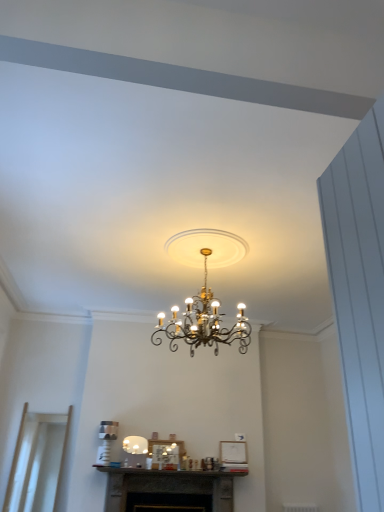
Question: Does white glossy lampshade at center, which is the 2th lamp in right-to-left order, have a greater height compared to transparent glass door at lower left?

Choices:
 (A) yes
 (B) no

Answer: (B)

Question: Is transparent glass door at lower left at the back of white glossy lampshade at center, positioned as the 1th lamp in left-to-right order?

Choices:
 (A) no
 (B) yes

Answer: (A)

Question: From the image's perspective, is white glossy lampshade at center, which ranks as the 2th lamp in top-to-bottom order, located above transparent glass door at lower left?

Choices:
 (A) no
 (B) yes

Answer: (B)

Question: Could you tell me if white glossy lampshade at center, placed as the first lamp when sorted from bottom to top, is facing transparent glass door at lower left?

Choices:
 (A) no
 (B) yes

Answer: (A)

Question: From the image's perspective, does white glossy lampshade at center, which is the 2th lamp from front to back, appear lower than transparent glass door at lower left?

Choices:
 (A) no
 (B) yes

Answer: (A)

Question: Relative to transparent glass door at lower left, is dark gray stone fireplace at center in front or behind?

Choices:
 (A) behind
 (B) front

Answer: (B)

Question: From the image's perspective, is dark gray stone fireplace at center above or below transparent glass door at lower left?

Choices:
 (A) below
 (B) above

Answer: (A)

Question: From a real-world perspective, is dark gray stone fireplace at center physically located above or below transparent glass door at lower left?

Choices:
 (A) above
 (B) below

Answer: (B)

Question: Is point (177, 476) closer or farther from the camera than point (33, 484)?

Choices:
 (A) closer
 (B) farther

Answer: (B)

Question: Relative to gold metallic chandelier at center, positioned as the second lamp in back-to-front order, is transparent glass door at lower left in front or behind?

Choices:
 (A) behind
 (B) front

Answer: (A)

Question: Considering the positions of transparent glass door at lower left and gold metallic chandelier at center, which is the second lamp from bottom to top, in the image, is transparent glass door at lower left wider or thinner than gold metallic chandelier at center, which is the second lamp from bottom to top,?

Choices:
 (A) wide
 (B) thin

Answer: (B)

Question: Is point (19, 502) closer or farther from the camera than point (185, 326)?

Choices:
 (A) closer
 (B) farther

Answer: (B)

Question: Do you think transparent glass door at lower left is within gold metallic chandelier at center, positioned as the second lamp in back-to-front order, or outside of it?

Choices:
 (A) inside
 (B) outside

Answer: (B)

Question: Which is correct: dark gray stone fireplace at center is inside white glossy lampshade at center, placed as the first lamp when sorted from bottom to top, or outside of it?

Choices:
 (A) inside
 (B) outside

Answer: (B)

Question: Does point (102, 466) appear closer or farther from the camera than point (142, 449)?

Choices:
 (A) closer
 (B) farther

Answer: (A)